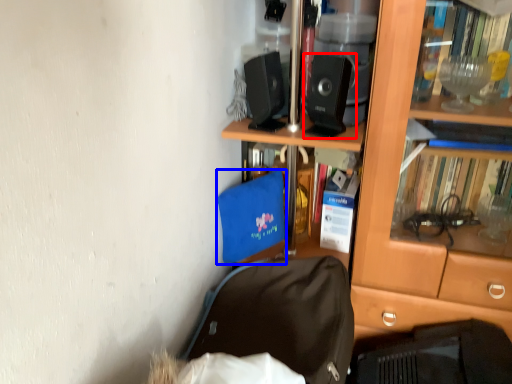
Question: Which of the following is the farthest to the observer, loudspeaker (highlighted by a red box) or luggage and bags (highlighted by a blue box)?

Choices:
 (A) loudspeaker
 (B) luggage and bags

Answer: (B)